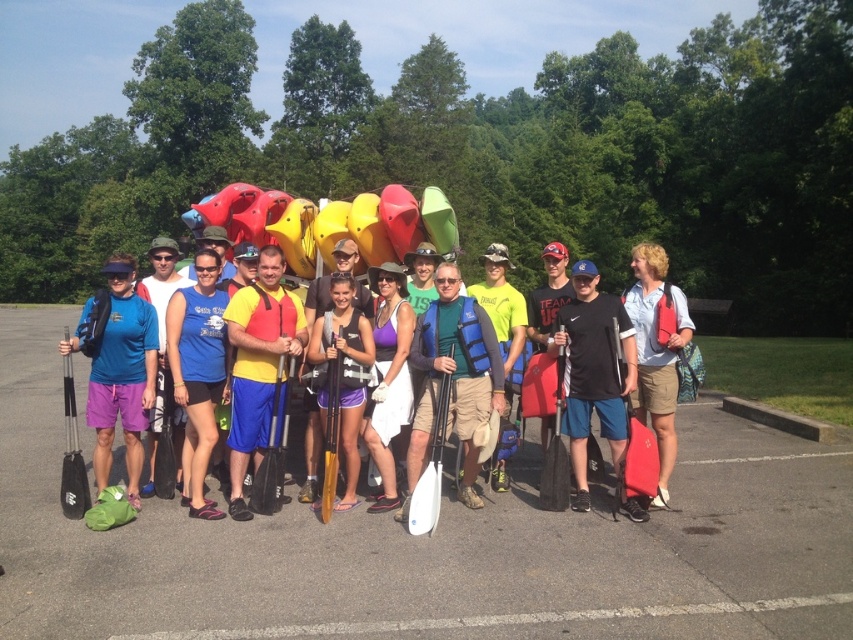
You are a photographer standing at the edge of the parking lot, and you want to take a photo that includes both the black rubber paddle at center and the light blue shirt at center. Given that your camera has a maximum focus range of 4 meters, will you be able to capture both subjects in focus without moving your position?

The black rubber paddle at center and the light blue shirt at center are 4.35 meters apart. Since the distance between them exceeds the camera maximum focus range of 4 meters, you won that be able to capture both subjects in focus without moving your position.

You are organizing a safety check for the group in the parking lot. You need to ensure that every participant has a life vest that is wider than their shirt to ensure proper flotation. Based on the image, does the yellow life vest at center meet the requirement for the light blue shirt at center?

The yellow life vest at center has a lesser width compared to light blue shirt at center, so it does not meet the requirement since the life vest needs to be wider than the shirt for proper flotation.